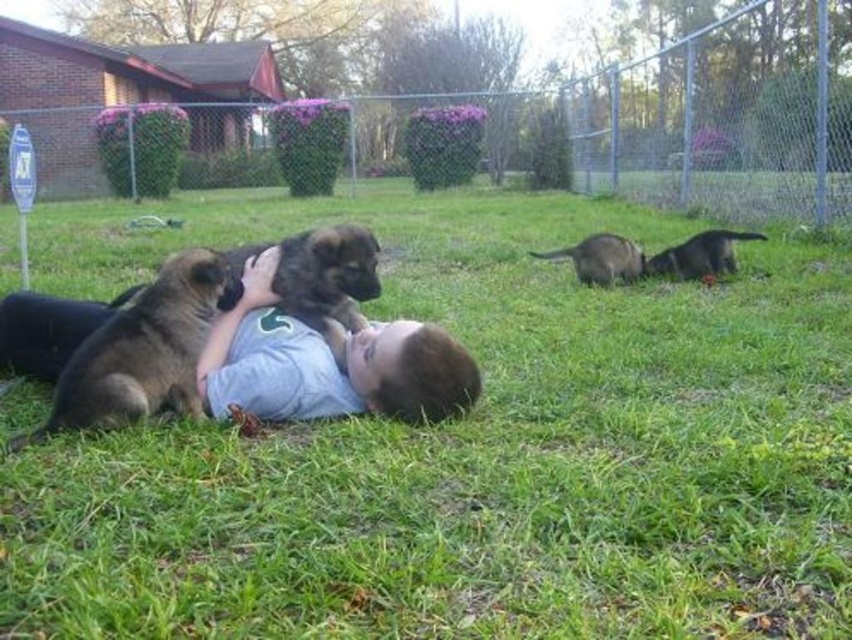
You are a drone operator trying to capture a photo of the green grass at center from above. The drone has a camera that can only focus on objects within a 0.1 unit radius around the point specified. If you set the drone to focus at point (468, 449), will it capture the green grass at center?

Yes, the point (468, 449) indicates green grass at center, so focusing there will capture it.

From the picture: You are a photographer trying to capture the scene with the green grass at center and the brown fur puppy at left. Which object takes up more area in the photo?

The brown fur puppy at left takes up more area in the photo than the green grass at center because the green grass at center occupies less space than brown fur puppy at left.

You are a photographer trying to capture a closeup of the green grass at center while also including the brown fur dog at center in the frame. Based on the scene description, which object should you focus on first to ensure both are in focus?

The green grass at center is closer to the viewer than the brown fur dog at center, so you should focus on the green grass at center first to ensure both are in focus.